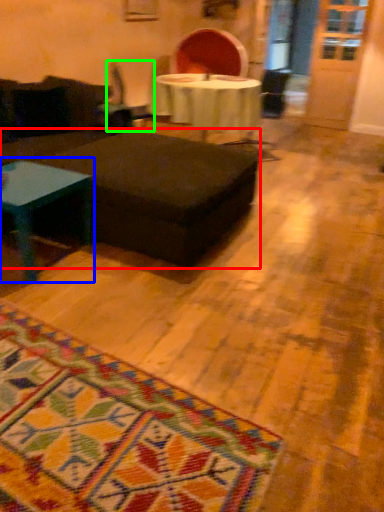
Question: Based on their relative distances, which object is farther from table (highlighted by a red box)? Choose from coffee table (highlighted by a blue box) and swivel chair (highlighted by a green box).

Choices:
 (A) coffee table
 (B) swivel chair

Answer: (B)